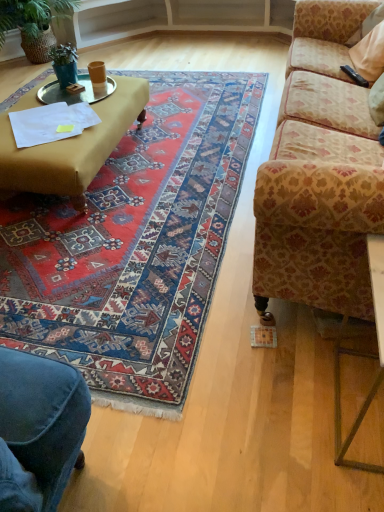
Question: Considering the relative positions of metallic gold table at lower right and green woven basket at upper left, the first houseplant in the back-to-front sequence, in the image provided, is metallic gold table at lower right to the left of green woven basket at upper left, the first houseplant in the back-to-front sequence, from the viewer's perspective?

Choices:
 (A) yes
 (B) no

Answer: (B)

Question: From a real-world perspective, is metallic gold table at lower right positioned under green woven basket at upper left, the first houseplant in the back-to-front sequence, based on gravity?

Choices:
 (A) yes
 (B) no

Answer: (A)

Question: Is metallic gold table at lower right not close to green woven basket at upper left, the first houseplant in the back-to-front sequence?

Choices:
 (A) yes
 (B) no

Answer: (A)

Question: Is metallic gold table at lower right closer to the viewer compared to green woven basket at upper left, which is the 2th houseplant from front to back?

Choices:
 (A) no
 (B) yes

Answer: (B)

Question: Is metallic gold table at lower right with green woven basket at upper left, acting as the first houseplant starting from the left?

Choices:
 (A) yes
 (B) no

Answer: (B)

Question: Is green woven basket at upper left, the second houseplant ordered from the bottom, wider or thinner than metallic gold table at lower right?

Choices:
 (A) wide
 (B) thin

Answer: (A)

Question: From a real-world perspective, is green woven basket at upper left, which is the 2th houseplant from front to back, positioned above or below metallic gold table at lower right?

Choices:
 (A) below
 (B) above

Answer: (B)

Question: Looking at the image, does green woven basket at upper left, placed as the 1th houseplant when sorted from top to bottom, seem bigger or smaller compared to metallic gold table at lower right?

Choices:
 (A) big
 (B) small

Answer: (A)

Question: From the image's perspective, is green woven basket at upper left, the first houseplant in the back-to-front sequence, above or below metallic gold table at lower right?

Choices:
 (A) below
 (B) above

Answer: (B)

Question: From a real-world perspective, is metallic silver tray at upper left positioned above or below patterned fabric couch at right?

Choices:
 (A) above
 (B) below

Answer: (B)

Question: Is point (56, 83) positioned closer to the camera than point (292, 126)?

Choices:
 (A) farther
 (B) closer

Answer: (A)

Question: Based on their positions, is metallic silver tray at upper left located to the left or right of patterned fabric couch at right?

Choices:
 (A) right
 (B) left

Answer: (B)

Question: Looking at their shapes, would you say metallic silver tray at upper left is wider or thinner than patterned fabric couch at right?

Choices:
 (A) wide
 (B) thin

Answer: (B)

Question: Relative to carpet with intricate patterns at center, is green matte plant at upper left, acting as the second houseplant starting from the back, in front or behind?

Choices:
 (A) behind
 (B) front

Answer: (A)

Question: From a real-world perspective, is green matte plant at upper left, positioned as the 1th houseplant in front-to-back order, positioned above or below carpet with intricate patterns at center?

Choices:
 (A) above
 (B) below

Answer: (A)